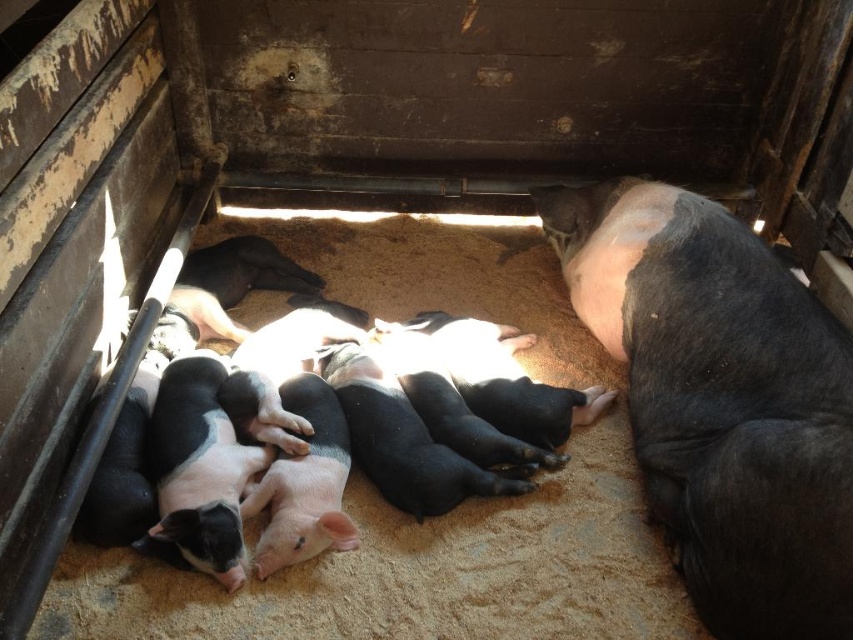
Question: Can you confirm if black matte pig at right is bigger than black matte piglets at center?

Choices:
 (A) no
 (B) yes

Answer: (A)

Question: Among these points, which one is farthest from the camera?

Choices:
 (A) click(306, 275)
 (B) click(732, 476)

Answer: (A)

Question: In this image, where is black matte pig at right located relative to black matte piglets at center?

Choices:
 (A) above
 (B) below

Answer: (A)

Question: Observing the image, what is the correct spatial positioning of black matte pig at right in reference to black matte piglets at center?

Choices:
 (A) right
 (B) left

Answer: (A)